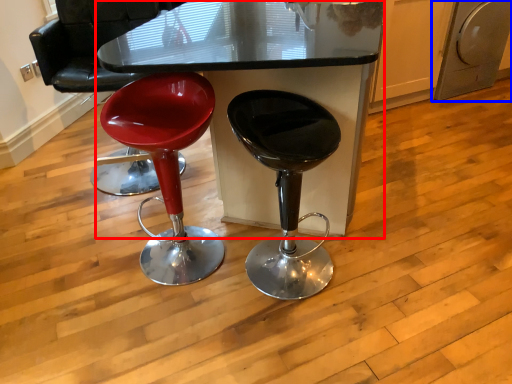
Question: Among these objects, which one is nearest to the camera, table (highlighted by a red box) or dish washer (highlighted by a blue box)?

Choices:
 (A) table
 (B) dish washer

Answer: (A)